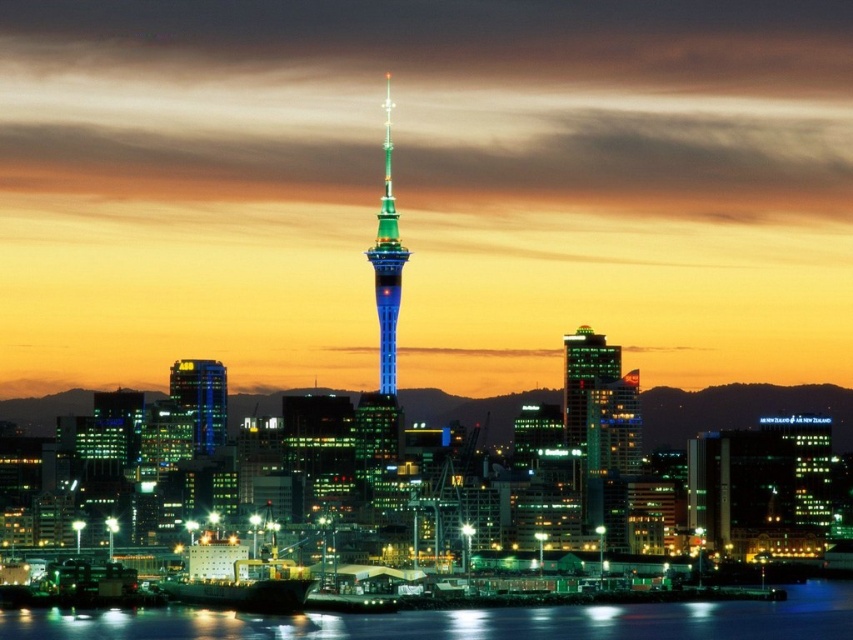
Question: Among these points, which one is nearest to the camera?

Choices:
 (A) (601, 355)
 (B) (195, 396)
 (C) (459, 625)
 (D) (384, 120)

Answer: (A)

Question: Which of the following is the closest to the observer?

Choices:
 (A) glossy water at lower center
 (B) matte glass skyscraper at center-left
 (C) green glass skyscraper at center
 (D) shiny glass tower at center

Answer: (D)

Question: Which object is the closest to the green glass skyscraper at center?

Choices:
 (A) glossy water at lower center
 (B) shiny glass tower at center
 (C) matte glass skyscraper at center-left

Answer: (B)

Question: Can you confirm if glossy water at lower center is positioned below green glass skyscraper at center?

Choices:
 (A) no
 (B) yes

Answer: (B)

Question: Does shiny glass tower at center appear under green glass skyscraper at center?

Choices:
 (A) yes
 (B) no

Answer: (B)

Question: Does shiny glass tower at center appear on the right side of green glass skyscraper at center?

Choices:
 (A) no
 (B) yes

Answer: (A)